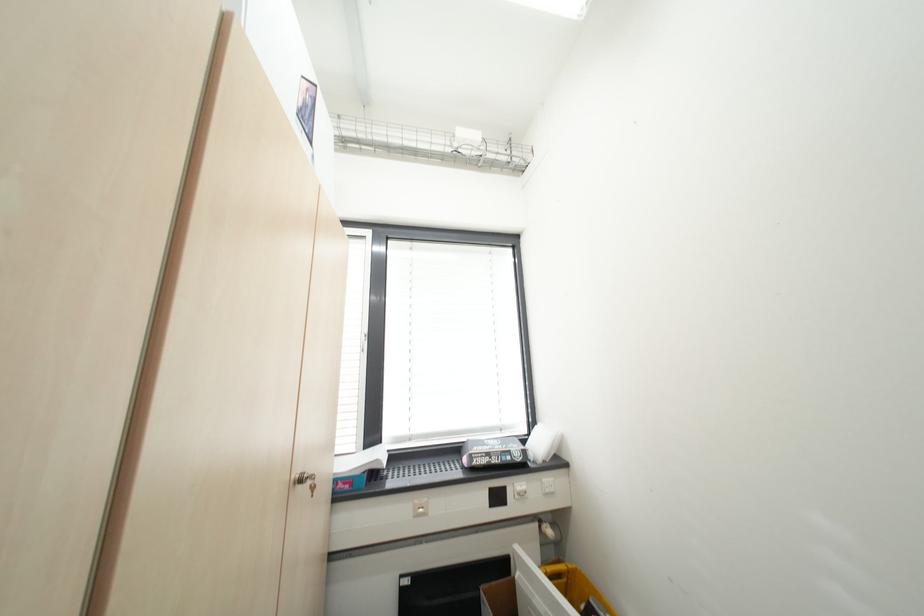
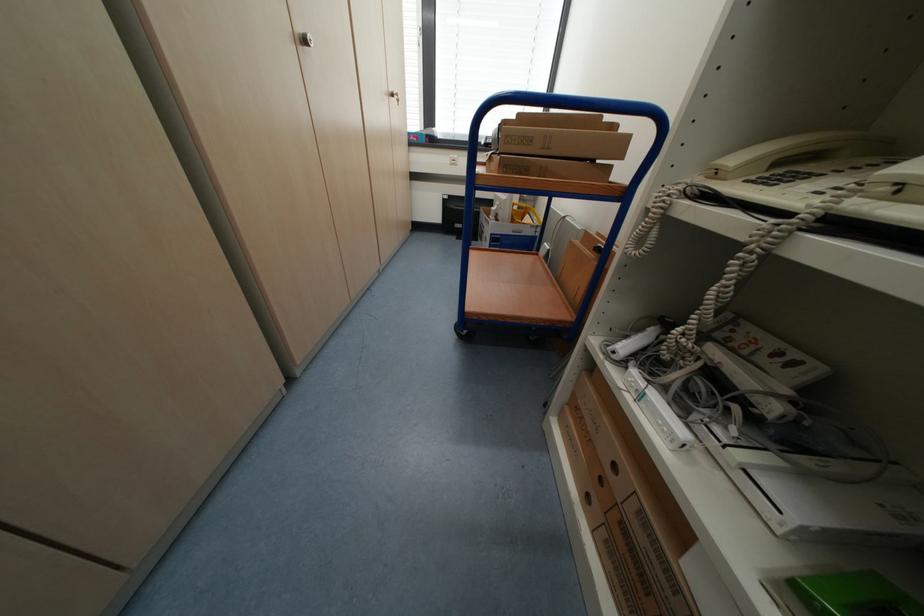
Find the pixel in the second image that matches (x=307, y=482) in the first image.

(398, 95)